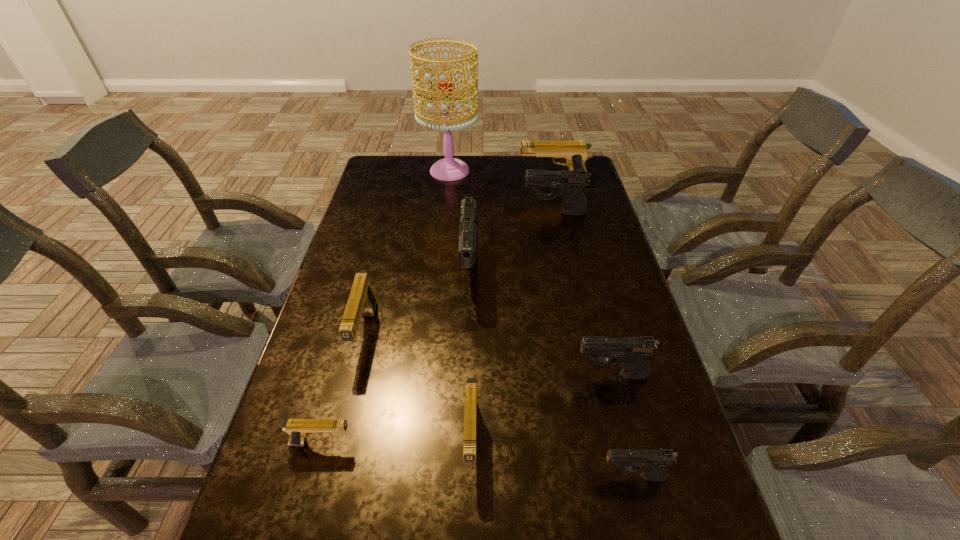
Where is `free space located at the barrel of the third smallest black pistol`? Image resolution: width=960 pixels, height=540 pixels. free space located at the barrel of the third smallest black pistol is located at coordinates (461, 213).

You are a GUI agent. You are given a task and a screenshot of the screen. Output one action in this format:
    pyautogui.click(x=<x>, y=<y>)
    Task: Click on the free spot located at the barrel of the third smallest tan pistol
    
    Given the screenshot: What is the action you would take?
    pyautogui.click(x=342, y=426)

The width and height of the screenshot is (960, 540). Identify the location of blank space located at the barrel of the third biggest black pistol. (445, 375).

Find the location of a particular element. The height and width of the screenshot is (540, 960). free space located at the barrel of the third biggest black pistol is located at coordinates (541, 375).

Find the location of `vacant region located at the barrel of the third biggest black pistol`. vacant region located at the barrel of the third biggest black pistol is located at coordinates (537, 375).

Identify the location of vacant space located 0.300m at the barrel of the smallest black pistol. Image resolution: width=960 pixels, height=540 pixels. (450, 477).

The height and width of the screenshot is (540, 960). I want to click on free space located 0.230m at the barrel of the smallest black pistol, so click(x=486, y=477).

Where is `vacant area situated at the barrel of the smallest black pistol`? This screenshot has width=960, height=540. vacant area situated at the barrel of the smallest black pistol is located at coordinates (536, 477).

Locate an element on the screen. The height and width of the screenshot is (540, 960). vacant space situated 0.090m at the barrel of the smallest tan pistol is located at coordinates (396, 443).

Locate an element on the screen. The height and width of the screenshot is (540, 960). lampshade at the far edge is located at coordinates (448, 169).